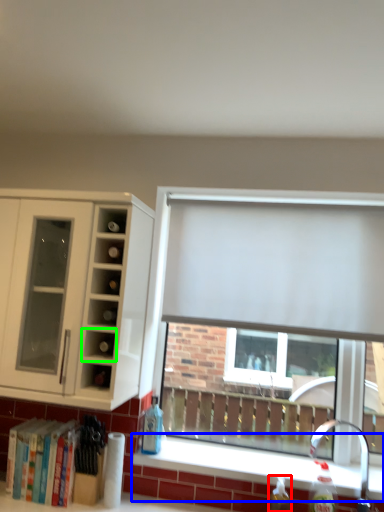
Question: Which object is the closest to the bottle (highlighted by a red box)? Choose among these: window sill (highlighted by a blue box) or cabinet (highlighted by a green box).

Choices:
 (A) window sill
 (B) cabinet

Answer: (A)